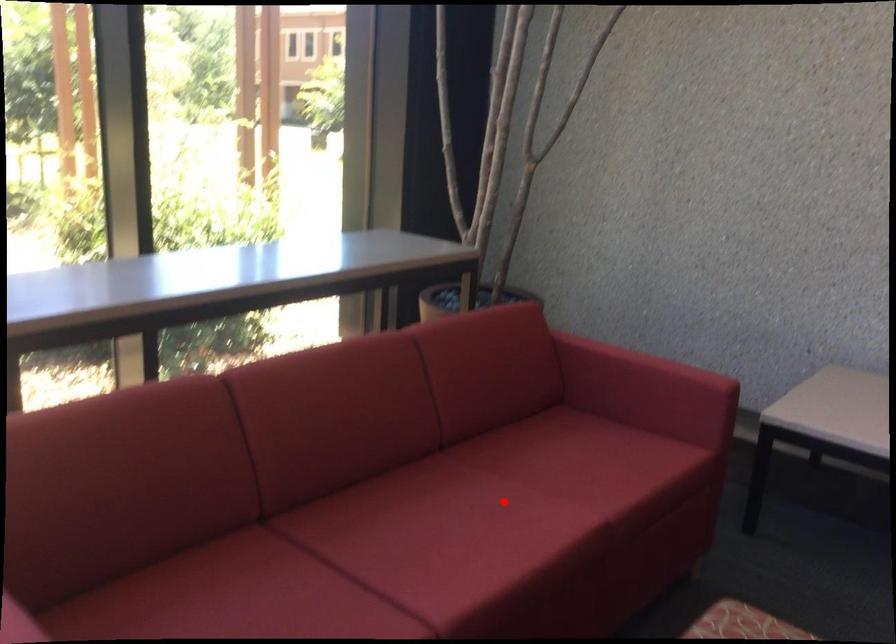
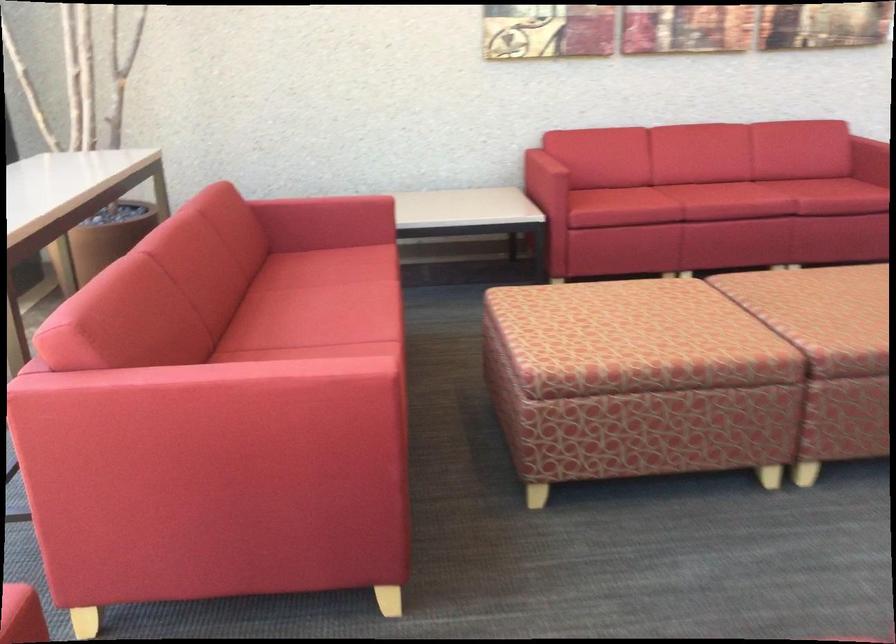
In the second image, find the point that corresponds to the highlighted location in the first image.

(334, 295)